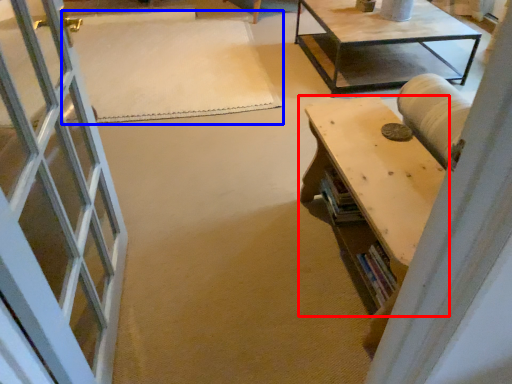
Question: Among these objects, which one is nearest to the camera, table (highlighted by a red box) or mat (highlighted by a blue box)?

Choices:
 (A) table
 (B) mat

Answer: (A)